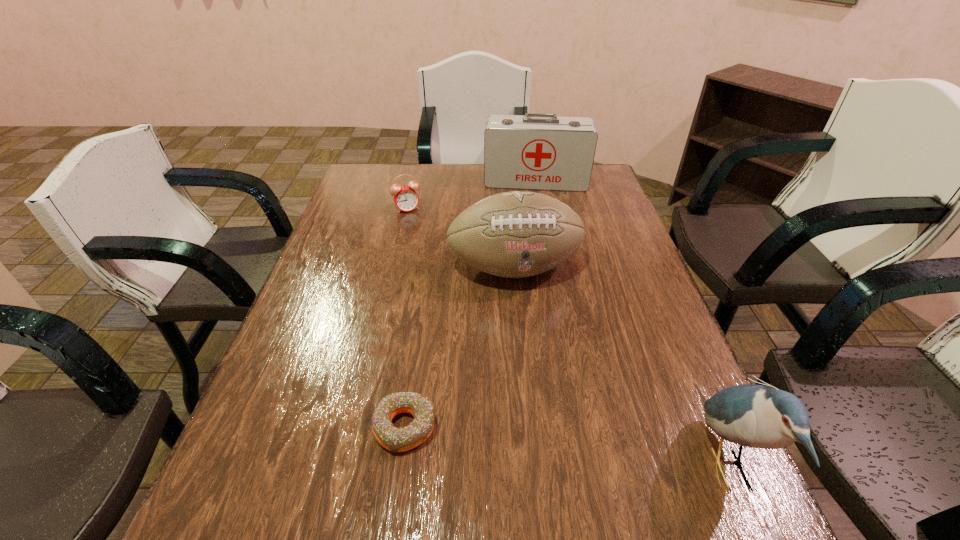
At what (x,y) coordinates should I click in order to perform the action: click on empty location between the rightmost object and the third nearest object. Please return your answer as a coordinate pair (x, y). Looking at the image, I should click on (621, 367).

The image size is (960, 540). Find the location of `vacant area that lies between the rightmost object and the first-aid kit`. vacant area that lies between the rightmost object and the first-aid kit is located at coordinates pos(632,325).

You are a GUI agent. You are given a task and a screenshot of the screen. Output one action in this format:
    pyautogui.click(x=<x>, y=<y>)
    Task: Click on the vacant area that lies between the rightmost object and the third farthest object
    
    Given the screenshot: What is the action you would take?
    pyautogui.click(x=621, y=367)

At what (x,y) coordinates should I click in order to perform the action: click on blank region between the doughnut and the third farthest object. Please return your answer as a coordinate pair (x, y). The image size is (960, 540). Looking at the image, I should click on (459, 347).

Identify the location of vacant space that's between the rightmost object and the alarm clock. Image resolution: width=960 pixels, height=540 pixels. (568, 338).

Where is `unoccupied area between the second farthest object and the bird`? This screenshot has width=960, height=540. unoccupied area between the second farthest object and the bird is located at coordinates (568, 338).

Where is `object that ranks as the third closest to the shortest object`? object that ranks as the third closest to the shortest object is located at coordinates (406, 198).

Locate an element on the screen. the closest object to the shortest object is located at coordinates (516, 234).

The image size is (960, 540). What are the coordinates of `vacant space that satisfies the following two spatial constraints: 1. on the front side of the first-aid kit; 2. at the tip of the rightmost object's beak` in the screenshot? It's located at (590, 467).

Where is `free region that satisfies the following two spatial constraints: 1. on the front side of the third nearest object; 2. on the left side of the fourth tallest object`? The height and width of the screenshot is (540, 960). free region that satisfies the following two spatial constraints: 1. on the front side of the third nearest object; 2. on the left side of the fourth tallest object is located at coordinates (394, 267).